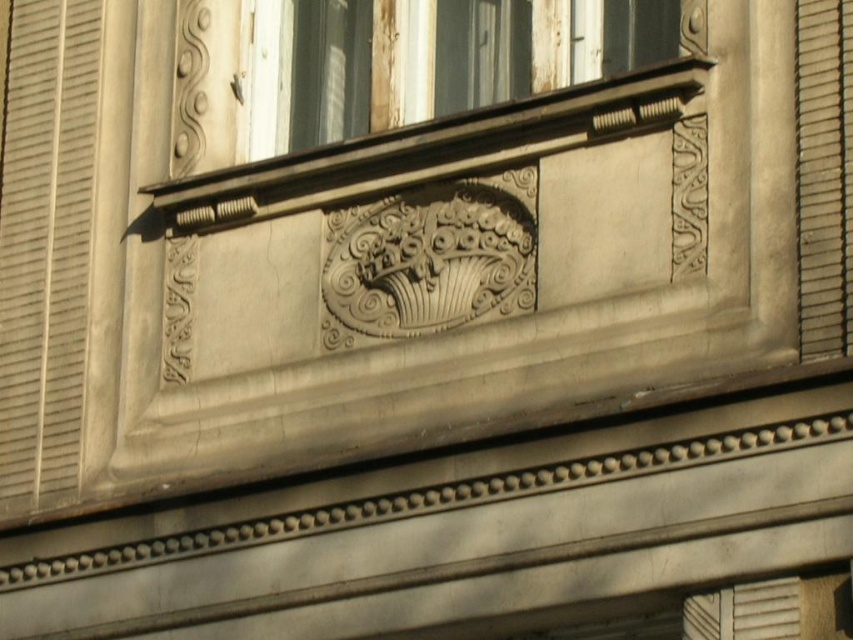
Question: Is white stone window sill at upper center bigger than metallic gray shutter at right?

Choices:
 (A) yes
 (B) no

Answer: (A)

Question: Is metallic silver shutter at left positioned behind wooden window at upper center?

Choices:
 (A) yes
 (B) no

Answer: (A)

Question: Which point is closer to the camera?

Choices:
 (A) metallic silver shutter at left
 (B) wooden window at upper center
 (C) white stone window sill at upper center

Answer: (C)

Question: Can you confirm if wooden window at upper center is positioned above metallic gray shutter at right?

Choices:
 (A) yes
 (B) no

Answer: (A)

Question: Which point is closer to the camera?

Choices:
 (A) (38, 132)
 (B) (809, 268)

Answer: (B)

Question: Based on their relative distances, which object is farther from the white stone window sill at upper center?

Choices:
 (A) wooden window at upper center
 (B) metallic gray shutter at right
 (C) metallic silver shutter at left

Answer: (C)